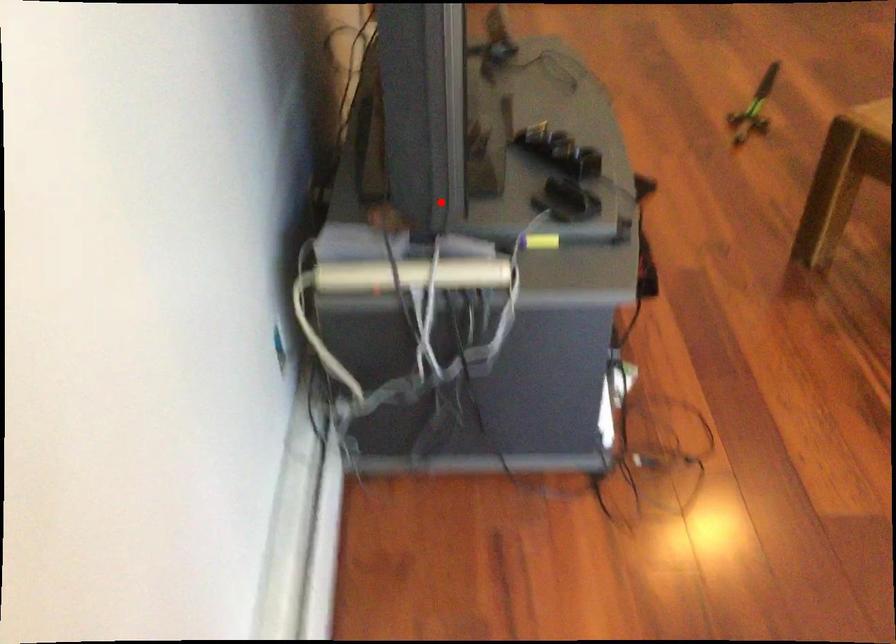
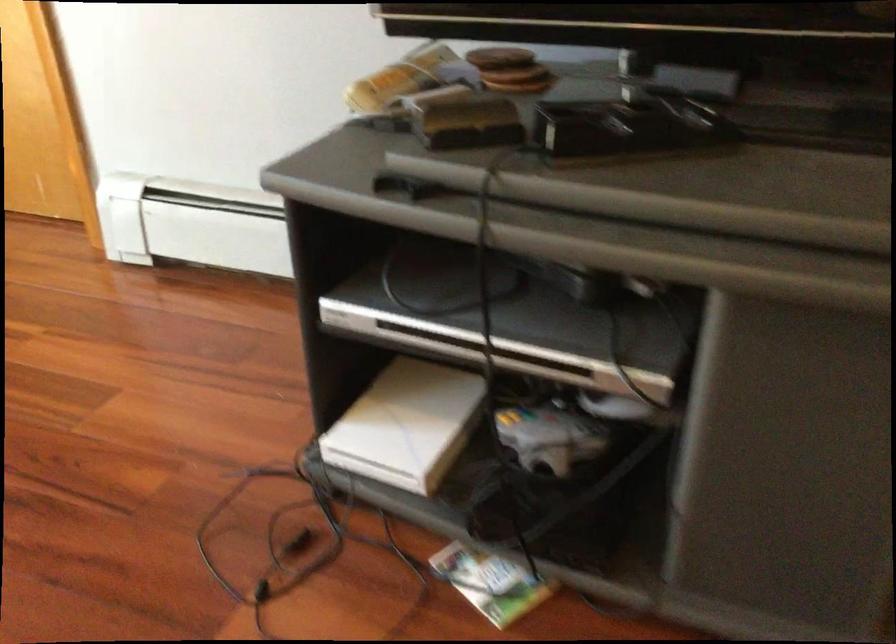
Question: I am providing you with two images of the same scene from different viewpoints. A red point is shown in image1. For the corresponding object point in image2, is it positioned nearer or farther from the camera?

Choices:
 (A) Nearer
 (B) Farther

Answer: (A)